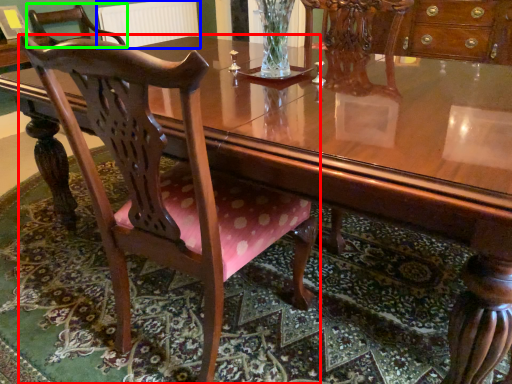
Question: Which is farther away from chair (highlighted by a red box)? radiator (highlighted by a blue box) or chair (highlighted by a green box)?

Choices:
 (A) radiator
 (B) chair

Answer: (A)